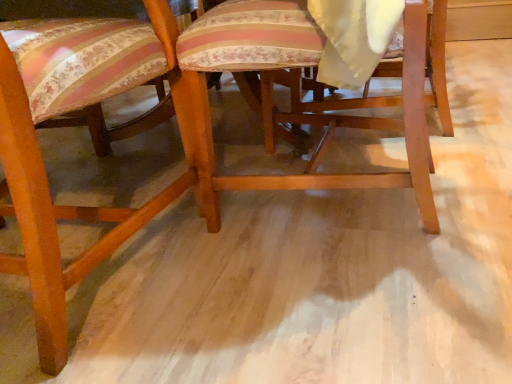
Question: Does wooden chair at center, arranged as the first chair when viewed from the left, have a smaller size compared to wooden chair at center, marked as the first chair in a right-to-left arrangement?

Choices:
 (A) no
 (B) yes

Answer: (A)

Question: Does wooden chair at center, the second chair when ordered from right to left, touch wooden chair at center, marked as the first chair in a right-to-left arrangement?

Choices:
 (A) no
 (B) yes

Answer: (A)

Question: From a real-world perspective, does wooden chair at center, arranged as the first chair when viewed from the left, stand above wooden chair at center, marked as the first chair in a right-to-left arrangement?

Choices:
 (A) yes
 (B) no

Answer: (A)

Question: Is wooden chair at center, arranged as the first chair when viewed from the left, taller than wooden chair at center, marked as the first chair in a right-to-left arrangement?

Choices:
 (A) yes
 (B) no

Answer: (A)

Question: Is wooden chair at center, arranged as the first chair when viewed from the left, facing towards wooden chair at center, the second chair positioned from the left?

Choices:
 (A) no
 (B) yes

Answer: (A)

Question: Considering the relative sizes of wooden chair at center, the second chair when ordered from right to left, and wooden chair at center, the second chair positioned from the left, in the image provided, is wooden chair at center, the second chair when ordered from right to left, thinner than wooden chair at center, the second chair positioned from the left,?

Choices:
 (A) yes
 (B) no

Answer: (B)

Question: Is wooden chair at center, marked as the first chair in a right-to-left arrangement, taller than wooden chair at center, arranged as the first chair when viewed from the left?

Choices:
 (A) yes
 (B) no

Answer: (B)

Question: Is the position of wooden chair at center, marked as the first chair in a right-to-left arrangement, less distant than that of wooden chair at center, arranged as the first chair when viewed from the left?

Choices:
 (A) no
 (B) yes

Answer: (A)

Question: From a real-world perspective, is wooden chair at center, marked as the first chair in a right-to-left arrangement, physically below wooden chair at center, arranged as the first chair when viewed from the left?

Choices:
 (A) yes
 (B) no

Answer: (A)

Question: Is wooden chair at center, marked as the first chair in a right-to-left arrangement, positioned far away from wooden chair at center, the second chair when ordered from right to left?

Choices:
 (A) yes
 (B) no

Answer: (B)

Question: From a real-world perspective, does wooden chair at center, the second chair positioned from the left, stand above wooden chair at center, the second chair when ordered from right to left?

Choices:
 (A) yes
 (B) no

Answer: (B)

Question: Considering the relative positions of wooden chair at center, marked as the first chair in a right-to-left arrangement, and wooden chair at center, arranged as the first chair when viewed from the left, in the image provided, is wooden chair at center, marked as the first chair in a right-to-left arrangement, to the left of wooden chair at center, arranged as the first chair when viewed from the left, from the viewer's perspective?

Choices:
 (A) no
 (B) yes

Answer: (A)

Question: From their relative heights in the image, would you say wooden chair at center, the second chair when ordered from right to left, is taller or shorter than wooden chair at center, marked as the first chair in a right-to-left arrangement?

Choices:
 (A) tall
 (B) short

Answer: (A)